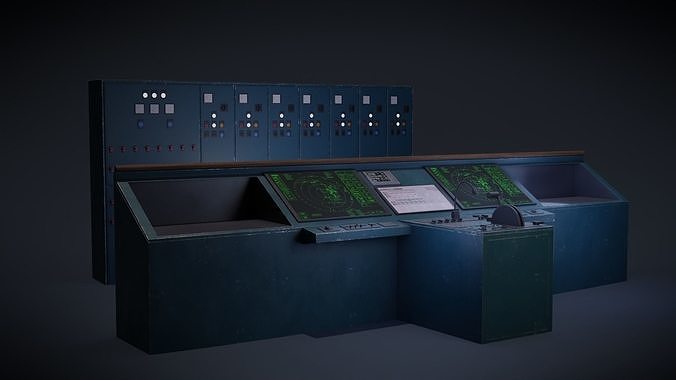
Image resolution: width=676 pixels, height=380 pixels. I want to click on screen, so click(x=329, y=202), click(x=504, y=185), click(x=420, y=202).